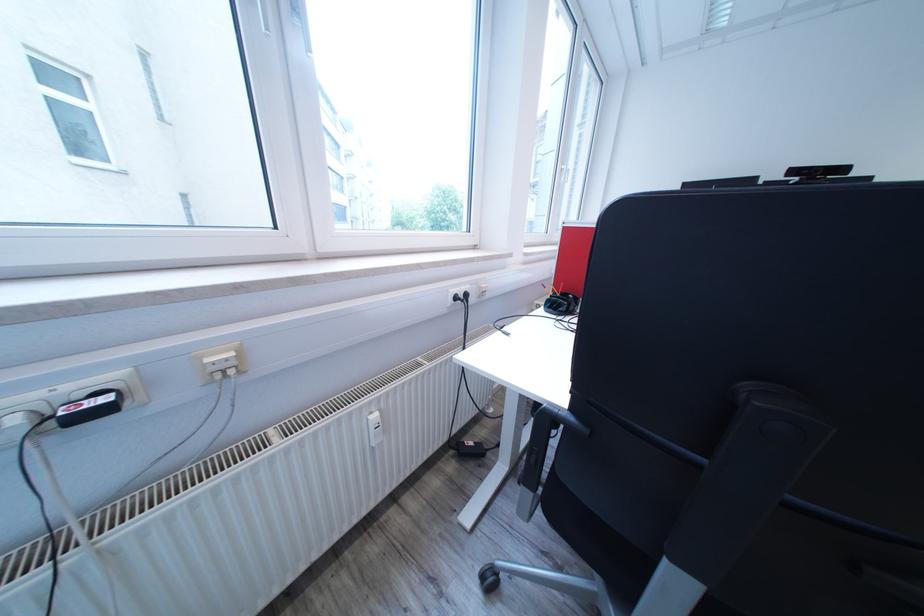
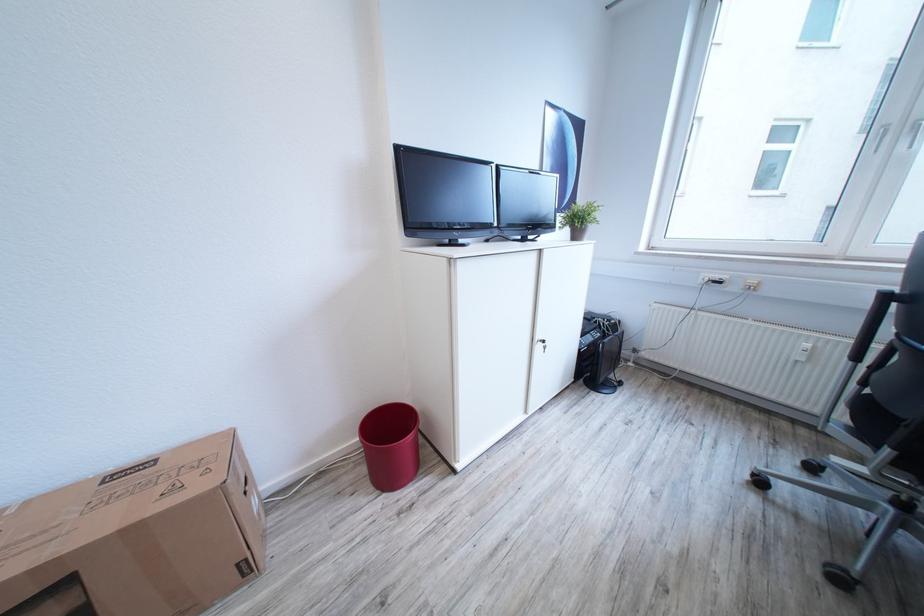
Question: I am providing you with two images of the same scene from different viewpoints. After the viewpoint changes to image2, which objects are now occluded?

Choices:
 (A) black chair armrest
 (B) radiator valve
 (C) black electric heater
 (D) none of these

Answer: (D)